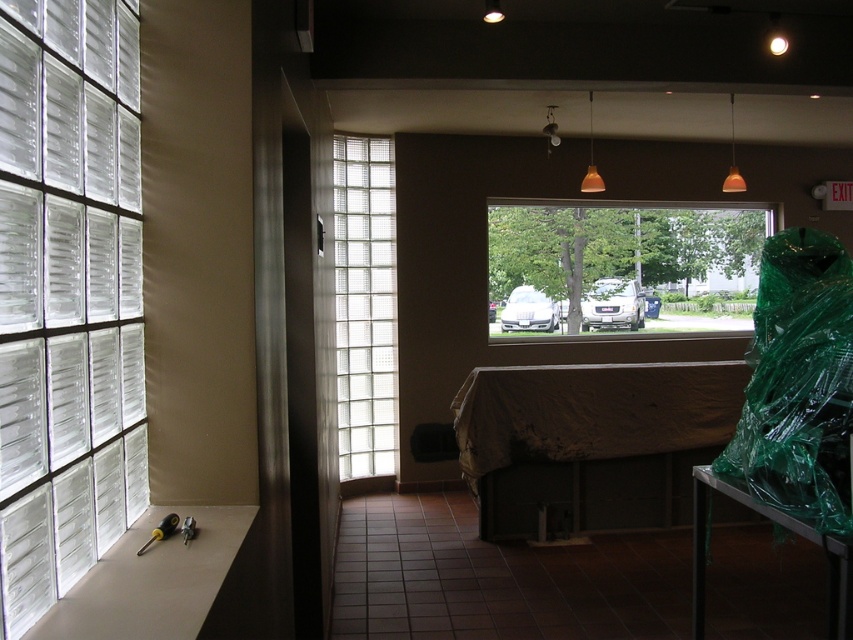
Does transparent glass window at center have a greater width compared to clear glass block at center?

Indeed, transparent glass window at center has a greater width compared to clear glass block at center.

This screenshot has height=640, width=853. In order to click on transparent glass window at center in this screenshot , I will do `click(622, 269)`.

Where is `transparent glass window at center`? The width and height of the screenshot is (853, 640). transparent glass window at center is located at coordinates (622, 269).

Does clear glass blocks at left appear on the left side of clear glass block at center?

Yes, clear glass blocks at left is to the left of clear glass block at center.

Is clear glass blocks at left taller than clear glass block at center?

In fact, clear glass blocks at left may be shorter than clear glass block at center.

What do you see at coordinates (67, 296) in the screenshot?
I see `clear glass blocks at left` at bounding box center [67, 296].

Where is `clear glass blocks at left`? This screenshot has height=640, width=853. clear glass blocks at left is located at coordinates (67, 296).

Is point (694, 230) farther from viewer compared to point (828, 285)?

Yes.

Image resolution: width=853 pixels, height=640 pixels. What do you see at coordinates (622, 269) in the screenshot?
I see `transparent glass window at center` at bounding box center [622, 269].

The width and height of the screenshot is (853, 640). What are the coordinates of `transparent glass window at center` in the screenshot? It's located at 622,269.